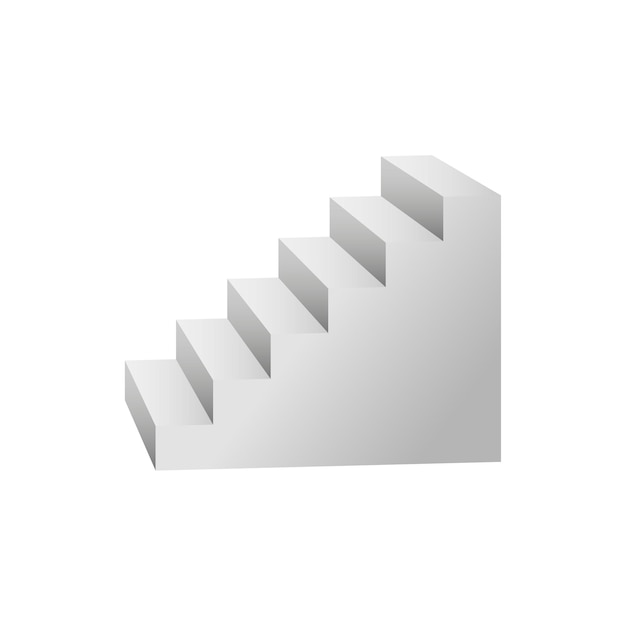
You are a GUI agent. You are given a task and a screenshot of the screen. Output one action in this format:
    pyautogui.click(x=<x>, y=<y>)
    Task: Click on the stairway step riser
    This screenshot has width=626, height=626.
    Given the screenshot: What is the action you would take?
    [x=139, y=408], [x=193, y=367], [x=249, y=324], [x=299, y=280], [x=355, y=237], [x=411, y=195]